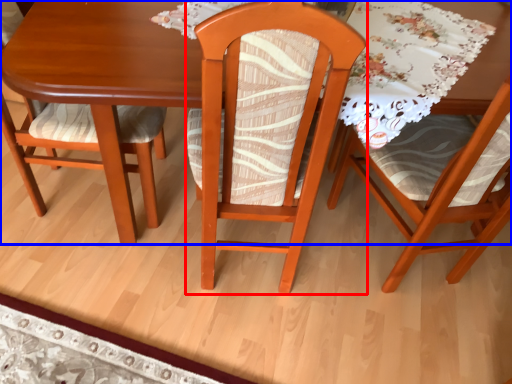
Question: Which of the following is the farthest to the observer, chair (highlighted by a red box) or table (highlighted by a blue box)?

Choices:
 (A) chair
 (B) table

Answer: (B)